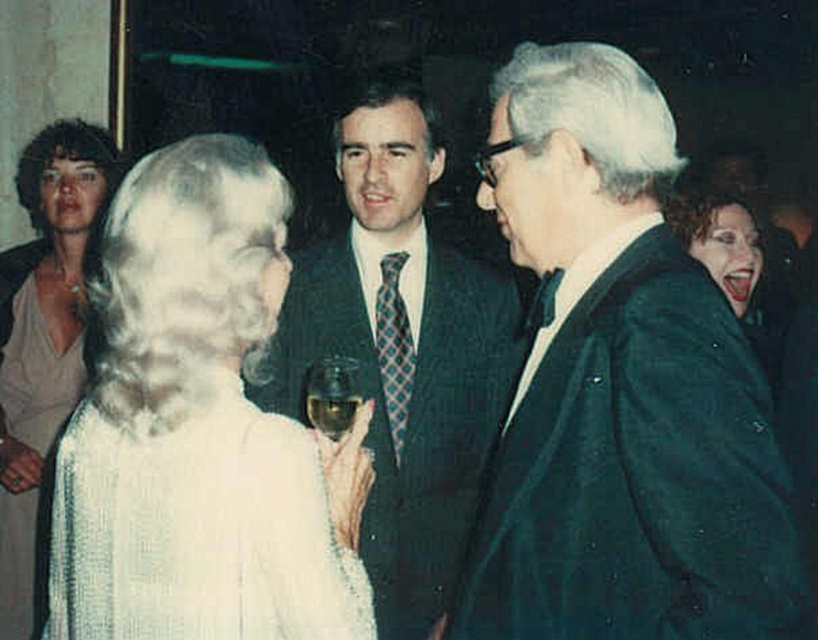
Is dark suit at center below blue plaid tie at center?

Incorrect, dark suit at center is not positioned below blue plaid tie at center.

Is dark suit at center bigger than blue plaid tie at center?

Indeed, dark suit at center has a larger size compared to blue plaid tie at center.

Does point (473, 445) lie behind point (398, 333)?

That is False.

The image size is (818, 640). Identify the location of dark suit at center. (402, 349).

Does dark suit at center have a lesser height compared to translucent glass at center?

Incorrect, dark suit at center's height does not fall short of translucent glass at center's.

Measure the distance between dark suit at center and translucent glass at center.

dark suit at center is 49.43 centimeters from translucent glass at center.

Does point (425, 257) come closer to viewer compared to point (326, 401)?

No, (425, 257) is behind (326, 401).

Identify the location of dark suit at center. This screenshot has width=818, height=640. (402, 349).

Is dark suit at center taller than clear glass wine glass at center?

Yes, dark suit at center is taller than clear glass wine glass at center.

Locate an element on the screen. dark suit at center is located at coordinates (402, 349).

Measure the distance between dark suit at center and camera.

2.12 meters

Where is `dark suit at center`? This screenshot has height=640, width=818. dark suit at center is located at coordinates (402, 349).